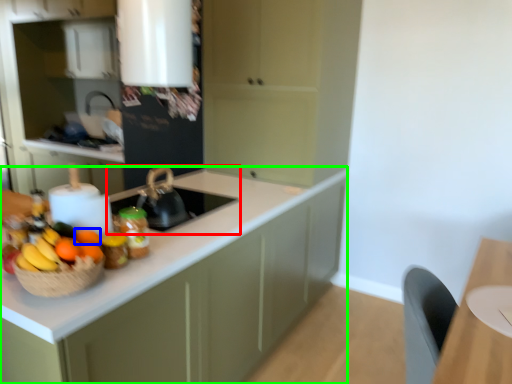
Question: Based on their relative distances, which object is farther from sink (highlighted by a red box)? Choose from orange (highlighted by a blue box) and cabinetry (highlighted by a green box).

Choices:
 (A) orange
 (B) cabinetry

Answer: (A)